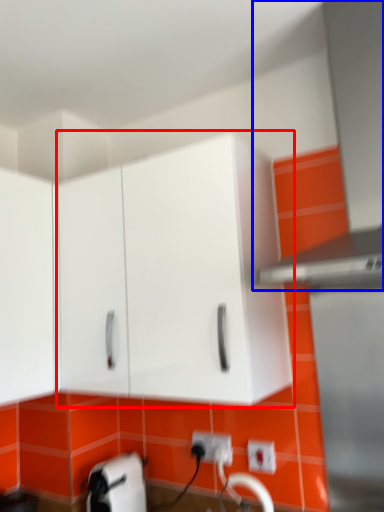
Question: Which object is closer to the camera taking this photo, cabinetry (highlighted by a red box) or exhaust hood (highlighted by a blue box)?

Choices:
 (A) cabinetry
 (B) exhaust hood

Answer: (B)